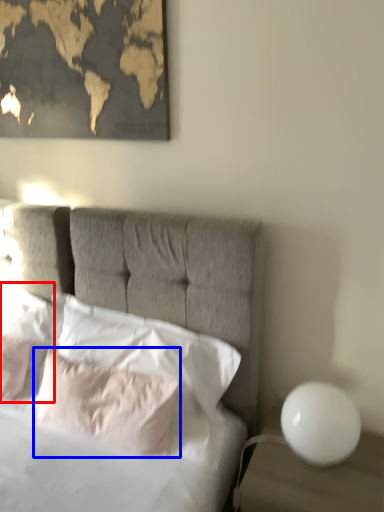
Question: Which object appears closest to the camera in this image, pillow (highlighted by a red box) or pillow (highlighted by a blue box)?

Choices:
 (A) pillow
 (B) pillow

Answer: (B)